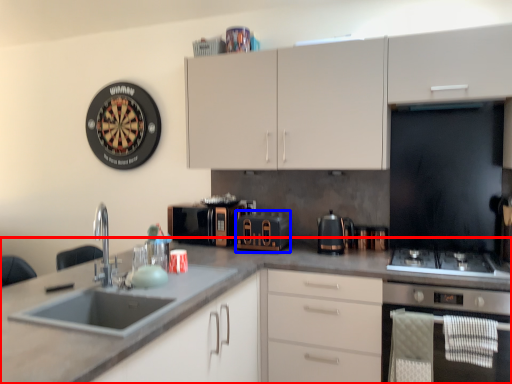
Question: Which point is further to the camera, countertop (highlighted by a red box) or appliance (highlighted by a blue box)?

Choices:
 (A) countertop
 (B) appliance

Answer: (B)